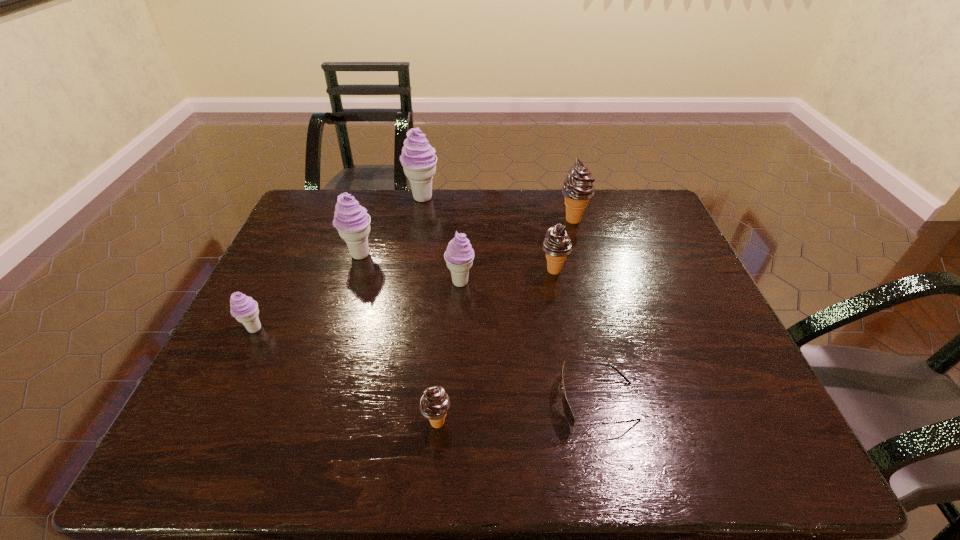
Locate an element on the screen. This screenshot has width=960, height=540. the second nearest icecream is located at coordinates (245, 310).

This screenshot has width=960, height=540. What are the coordinates of `the leftmost icecream` in the screenshot? It's located at (245, 310).

Locate an element on the screen. the smallest chocolate icecream is located at coordinates (434, 404).

Find the location of a particular element. the nearest chocolate icecream is located at coordinates (434, 404).

Find the location of a particular element. The height and width of the screenshot is (540, 960). the shortest object is located at coordinates (568, 413).

Where is `vacant space located 0.250m on the front of the third object from left to right`? The image size is (960, 540). vacant space located 0.250m on the front of the third object from left to right is located at coordinates (412, 256).

The height and width of the screenshot is (540, 960). What are the coordinates of `free point located on the back of the third nearest purple icecream` in the screenshot? It's located at (368, 230).

What are the coordinates of `free location located on the front of the rightmost chocolate icecream` in the screenshot? It's located at (598, 314).

Find the location of a particular element. This screenshot has height=540, width=960. free region located on the right of the second smallest chocolate icecream is located at coordinates (596, 271).

Where is `vacant space located on the front of the rightmost purple icecream`? This screenshot has width=960, height=540. vacant space located on the front of the rightmost purple icecream is located at coordinates (459, 306).